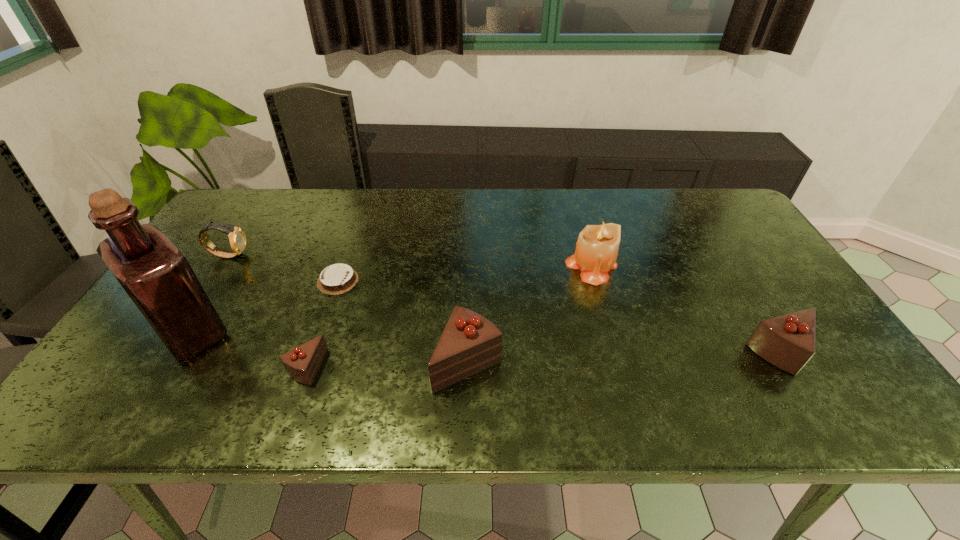
If equal spacing is the goal by inserting an additional chocolate_cake among them, please point out a vacant space for this new chocolate_cake. Please provide its 2D coordinates. Your answer should be formatted as a tuple, i.e. [(x, y)], where the tuple contains the x and y coordinates of a point satisfying the conditions above.

[(626, 357)]